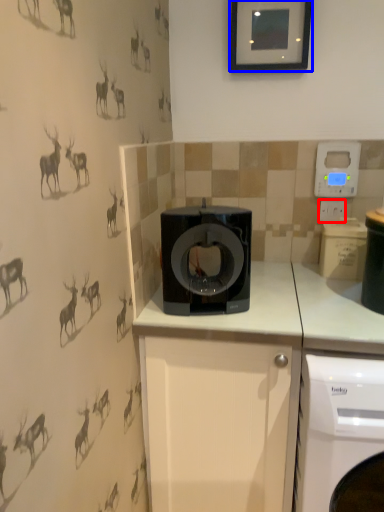
Question: Which object is further to the camera taking this photo, electric outlet (highlighted by a red box) or picture frame (highlighted by a blue box)?

Choices:
 (A) electric outlet
 (B) picture frame

Answer: (A)